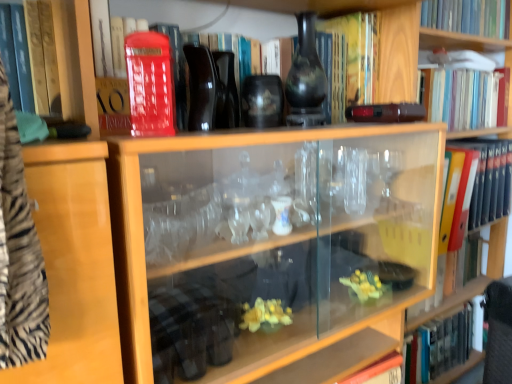
Describe the element at coordinates (489, 180) in the screenshot. The image size is (512, 384). I see `orange file folder at right, which appears as the fifth book when viewed from the top` at that location.

What do you see at coordinates (444, 344) in the screenshot?
I see `hardcover book at lower right, which is the sixth book from top to bottom` at bounding box center [444, 344].

Measure the distance between point (x=440, y=136) and camera.

Point (x=440, y=136) and camera are 1.04 meters apart from each other.

This screenshot has height=384, width=512. What are the coordinates of `matte red book at upper center, which is counted as the third book, starting from the bottom` in the screenshot? It's located at (207, 17).

At what (x,y) coordinates should I click in order to perform the action: click on matte red phone box at upper left. Please return your answer as a coordinate pair (x, y). Looking at the image, I should click on (150, 84).

The width and height of the screenshot is (512, 384). What are the coordinates of `orange file folder at right, acting as the 2th book starting from the bottom` in the screenshot? It's located at (489, 180).

Between point (319, 67) and point (170, 83), which one is positioned in front?

The point (170, 83) is closer.

Is matte black vase at upper center beside matte red phone box at upper left?

There is a gap between matte black vase at upper center and matte red phone box at upper left.

Is matte black vase at upper center taller than matte red phone box at upper left?

Correct, matte black vase at upper center is much taller as matte red phone box at upper left.

Considering the relative sizes of hardcover book at upper right, the 1th book from the top, and yellow matte book at upper center, arranged as the fourth book when ordered from the bottom, in the image provided, is hardcover book at upper right, the 1th book from the top, wider than yellow matte book at upper center, arranged as the fourth book when ordered from the bottom,?

Incorrect, the width of hardcover book at upper right, the 1th book from the top, does not surpass that of yellow matte book at upper center, arranged as the fourth book when ordered from the bottom.

Is the depth of hardcover book at upper right, the 6th book from the bottom, less than that of yellow matte book at upper center, the third book positioned from the top?

No, hardcover book at upper right, the 6th book from the bottom, is further to the viewer.

Is hardcover book at upper right, the 6th book from the bottom, to the left or to the right of yellow matte book at upper center, arranged as the fourth book when ordered from the bottom, in the image?

Clearly, hardcover book at upper right, the 6th book from the bottom, is on the right of yellow matte book at upper center, arranged as the fourth book when ordered from the bottom, in the image.

From the image's perspective, would you say hardcover book at upper right, the 6th book from the bottom, is shown under yellow matte book at upper center, arranged as the fourth book when ordered from the bottom?

No, from the image's perspective, hardcover book at upper right, the 6th book from the bottom, is not below yellow matte book at upper center, arranged as the fourth book when ordered from the bottom.

From the image's perspective, is hardcover book at lower right, which is the sixth book from top to bottom, under hardcover book at upper right, the 6th book from the bottom?

Correct, hardcover book at lower right, which is the sixth book from top to bottom, appears lower than hardcover book at upper right, the 6th book from the bottom, in the image.

Which of these two, hardcover book at lower right, which is the sixth book from top to bottom, or hardcover book at upper right, the 1th book from the top, is thinner?

hardcover book at lower right, which is the sixth book from top to bottom.

From a real-world perspective, is hardcover book at lower right, which is the sixth book from top to bottom, on top of hardcover book at upper right, the 6th book from the bottom?

Actually, hardcover book at lower right, which is the sixth book from top to bottom, is physically below hardcover book at upper right, the 6th book from the bottom, in the real world.

Considering the positions of objects hardcover book at lower right, which is the sixth book from top to bottom, and hardcover book at upper right, the 1th book from the top, in the image provided, who is more to the right, hardcover book at lower right, which is the sixth book from top to bottom, or hardcover book at upper right, the 1th book from the top,?

hardcover book at lower right, which is the sixth book from top to bottom, is more to the right.

Considering the relative positions of wooden bookshelf at upper right and orange file folder at right, which appears as the fifth book when viewed from the top, in the image provided, is wooden bookshelf at upper right to the left of orange file folder at right, which appears as the fifth book when viewed from the top, from the viewer's perspective?

Yes, wooden bookshelf at upper right is to the left of orange file folder at right, which appears as the fifth book when viewed from the top.

Can we say wooden bookshelf at upper right lies outside orange file folder at right, acting as the 2th book starting from the bottom?

Yes, wooden bookshelf at upper right is not within orange file folder at right, acting as the 2th book starting from the bottom.

Can you confirm if wooden bookshelf at upper right is wider than orange file folder at right, which appears as the fifth book when viewed from the top?

Correct, the width of wooden bookshelf at upper right exceeds that of orange file folder at right, which appears as the fifth book when viewed from the top.

Is wooden bookshelf at upper right facing away from orange file folder at right, which appears as the fifth book when viewed from the top?

Yes, wooden bookshelf at upper right is facing away from orange file folder at right, which appears as the fifth book when viewed from the top.

Can you confirm if yellow matte book at upper center, arranged as the fourth book when ordered from the bottom, is smaller than matte red phone box at upper left?

No.

Is yellow matte book at upper center, the third book positioned from the top, not inside matte red phone box at upper left?

That's correct, yellow matte book at upper center, the third book positioned from the top, is outside of matte red phone box at upper left.

How far apart are yellow matte book at upper center, the third book positioned from the top, and matte red phone box at upper left?

24.50 inches.

Is matte red book at upper center, which is counted as the third book, starting from the bottom, aimed at hardcover book at upper right, the 1th book from the top?

No.

Find the location of a particular element. The height and width of the screenshot is (384, 512). book that is the 3rd one when counting downward from the hardcover book at upper right, the 1th book from the top (from the image's perspective) is located at coordinates (x=207, y=17).

Between matte red book at upper center, acting as the 4th book starting from the top, and hardcover book at upper right, the 6th book from the bottom, which one has less height?

hardcover book at upper right, the 6th book from the bottom, is shorter.

Considering the sizes of objects matte red book at upper center, acting as the 4th book starting from the top, and wooden bookshelf at upper right in the image provided, who is smaller, matte red book at upper center, acting as the 4th book starting from the top, or wooden bookshelf at upper right?

With smaller size is matte red book at upper center, acting as the 4th book starting from the top.

Does point (236, 25) lie in front of point (303, 352)?

No.

From a real-world perspective, which object rests below the other?

wooden bookshelf at upper right, from a real-world perspective.

Is matte red book at upper center, which is counted as the third book, starting from the bottom, taller than wooden bookshelf at upper right?

No, matte red book at upper center, which is counted as the third book, starting from the bottom, is not taller than wooden bookshelf at upper right.

This screenshot has height=384, width=512. I want to click on glass vase that is behind the matte red phone box at upper left, so click(x=306, y=68).

There is a hardcover book at upper right, the 6th book from the bottom. At what (x,y) coordinates should I click in order to perform the action: click on the 1st book below it (from a real-world perspective). Please return your answer as a coordinate pair (x, y). This screenshot has width=512, height=384. Looking at the image, I should click on coord(358,53).

When comparing their distances from yellow matte book at upper center, arranged as the fourth book when ordered from the bottom, does orange file folder at right, which appears as the fifth book when viewed from the top, or matte red book at upper center, acting as the 4th book starting from the top, seem closer?

matte red book at upper center, acting as the 4th book starting from the top, is positioned closer to the anchor yellow matte book at upper center, arranged as the fourth book when ordered from the bottom.

When comparing their distances from hardcover book at lower right, placed as the first book when sorted from bottom to top, does hardcover book at upper right, the 1th book from the top, or matte red book at upper center, acting as the 4th book starting from the top, seem closer?

hardcover book at upper right, the 1th book from the top, is closer to hardcover book at lower right, placed as the first book when sorted from bottom to top.

When comparing their distances from hardcover book at lower right, which is the sixth book from top to bottom, does matte red book at upper center, which is counted as the third book, starting from the bottom, or matte black vase at upper center seem further?

matte red book at upper center, which is counted as the third book, starting from the bottom, is positioned further to the anchor hardcover book at lower right, which is the sixth book from top to bottom.

When comparing their distances from yellow matte book at upper center, arranged as the fourth book when ordered from the bottom, does matte red phone box at upper left or hardcover book at lower right, which is the sixth book from top to bottom, seem further?

Among the two, hardcover book at lower right, which is the sixth book from top to bottom, is located further to yellow matte book at upper center, arranged as the fourth book when ordered from the bottom.

Considering their positions, is hardcover book at upper right, acting as the fifth book starting from the bottom, positioned closer to yellow matte book at upper center, the third book positioned from the top, than matte black vase at upper center?

matte black vase at upper center lies closer to yellow matte book at upper center, the third book positioned from the top, than the other object.

From the image, which object appears to be farther from hardcover book at upper right, acting as the fifth book starting from the bottom, matte red phone box at upper left or matte red book at upper center, which is counted as the third book, starting from the bottom?

Among the two, matte red phone box at upper left is located further to hardcover book at upper right, acting as the fifth book starting from the bottom.

When comparing their distances from matte black vase at upper center, does matte red book at upper center, which is counted as the third book, starting from the bottom, or yellow matte book at upper center, the third book positioned from the top, seem further?

Based on the image, yellow matte book at upper center, the third book positioned from the top, appears to be further to matte black vase at upper center.

Looking at the image, which one is located closer to orange file folder at right, acting as the 2th book starting from the bottom, matte black vase at upper center or hardcover book at lower right, which is the sixth book from top to bottom?

hardcover book at lower right, which is the sixth book from top to bottom.

The image size is (512, 384). Identify the location of bookshelf between yellow matte book at upper center, the third book positioned from the top, and hardcover book at lower right, which is the sixth book from top to bottom, in the up-down direction. (361, 248).

Identify the location of glass vase between matte red phone box at upper left and hardcover book at upper right, the 6th book from the bottom, from left to right. This screenshot has height=384, width=512. (306, 68).

This screenshot has height=384, width=512. I want to click on book between matte black vase at upper center and hardcover book at upper right, the 1th book from the top, so click(x=358, y=53).

Identify the location of bookshelf between orange file folder at right, acting as the 2th book starting from the bottom, and hardcover book at lower right, which is the sixth book from top to bottom, vertically. This screenshot has width=512, height=384. (361, 248).